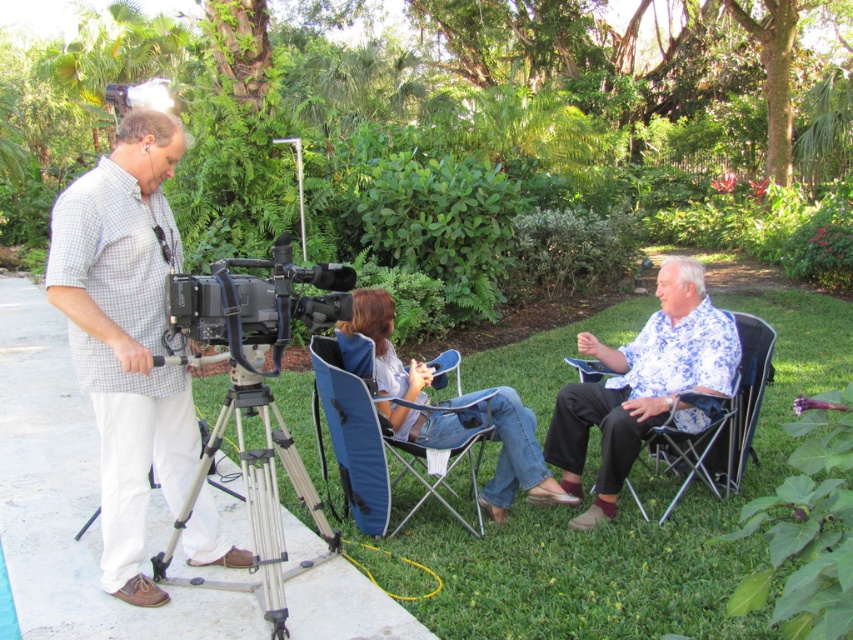
Question: Is checkered fabric shirt at left wider than black plastic camera at center?

Choices:
 (A) no
 (B) yes

Answer: (B)

Question: Which is nearer to the blue fabric chair at center?

Choices:
 (A) checkered fabric shirt at left
 (B) black plastic camera at center
 (C) blue floral shirt at center

Answer: (C)

Question: Which is farther from the checkered fabric shirt at left?

Choices:
 (A) silver metallic tripod at lower left
 (B) black plastic camera at center

Answer: (B)

Question: Which of the following is the closest to the observer?

Choices:
 (A) blue fabric chair at center
 (B) blue floral shirt at center
 (C) checkered fabric shirt at left
 (D) silver metallic tripod at lower left

Answer: (C)

Question: Does blue floral shirt at center have a greater width compared to denim jeans at center?

Choices:
 (A) yes
 (B) no

Answer: (B)

Question: Is blue floral shirt at center bigger than blue fabric chair at center?

Choices:
 (A) no
 (B) yes

Answer: (A)